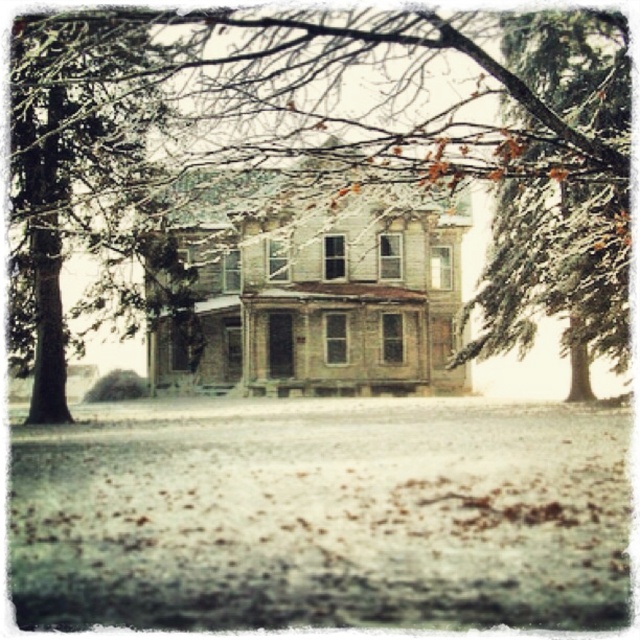
Describe the element at coordinates (342, 90) in the screenshot. This screenshot has height=640, width=640. I see `snow-covered pine tree at center` at that location.

Where is `snow-covered pine tree at center`? This screenshot has width=640, height=640. snow-covered pine tree at center is located at coordinates (342, 90).

Is white fluffy snow at lower center to the right of snow-covered pine tree at center from the viewer's perspective?

Incorrect, white fluffy snow at lower center is not on the right side of snow-covered pine tree at center.

Consider the image. Does white fluffy snow at lower center have a smaller size compared to snow-covered pine tree at center?

Yes.

The height and width of the screenshot is (640, 640). Describe the element at coordinates (321, 515) in the screenshot. I see `white fluffy snow at lower center` at that location.

Where is `white fluffy snow at lower center`? The width and height of the screenshot is (640, 640). white fluffy snow at lower center is located at coordinates (321, 515).

The image size is (640, 640). Describe the element at coordinates (321, 515) in the screenshot. I see `white fluffy snow at lower center` at that location.

Is point (433, 403) positioned in front of point (502, 305)?

No, it is not.

Identify the location of white fluffy snow at lower center. (321, 515).